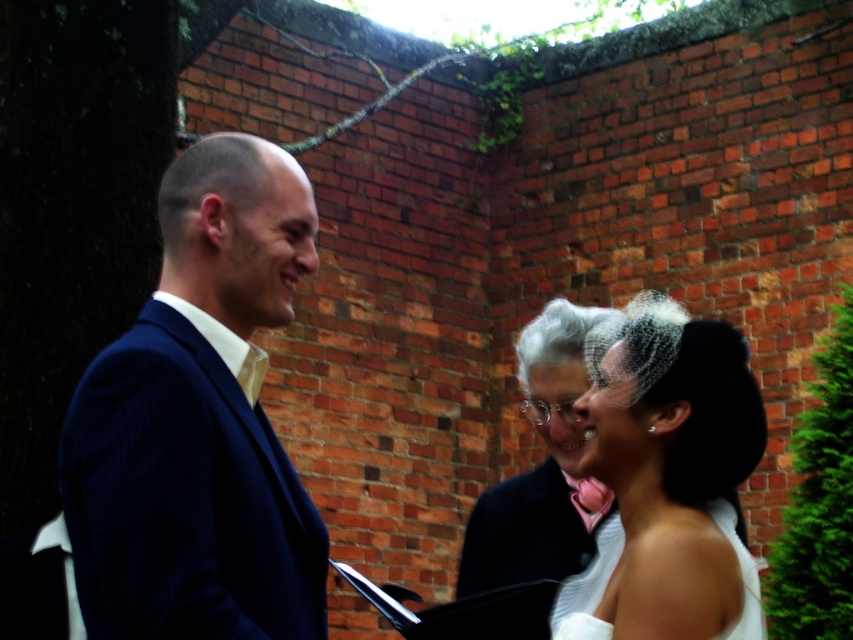
Question: Where is matte black suit at center located in relation to white satin veil at center in the image?

Choices:
 (A) right
 (B) left

Answer: (B)

Question: Can you confirm if matte black suit at center is bigger than navy blue suit at left?

Choices:
 (A) no
 (B) yes

Answer: (B)

Question: Estimate the real-world distances between objects in this image. Which object is farther from the white satin veil at center?

Choices:
 (A) matte black suit at center
 (B) navy blue suit at left

Answer: (B)

Question: From the image, what is the correct spatial relationship of matte black suit at center in relation to navy blue suit at left?

Choices:
 (A) below
 (B) above

Answer: (A)

Question: Which is farther from the matte black suit at center?

Choices:
 (A) navy blue suit at left
 (B) white satin veil at center

Answer: (B)

Question: Based on their relative distances, which object is nearer to the navy blue suit at left?

Choices:
 (A) white satin veil at center
 (B) matte black suit at center

Answer: (B)